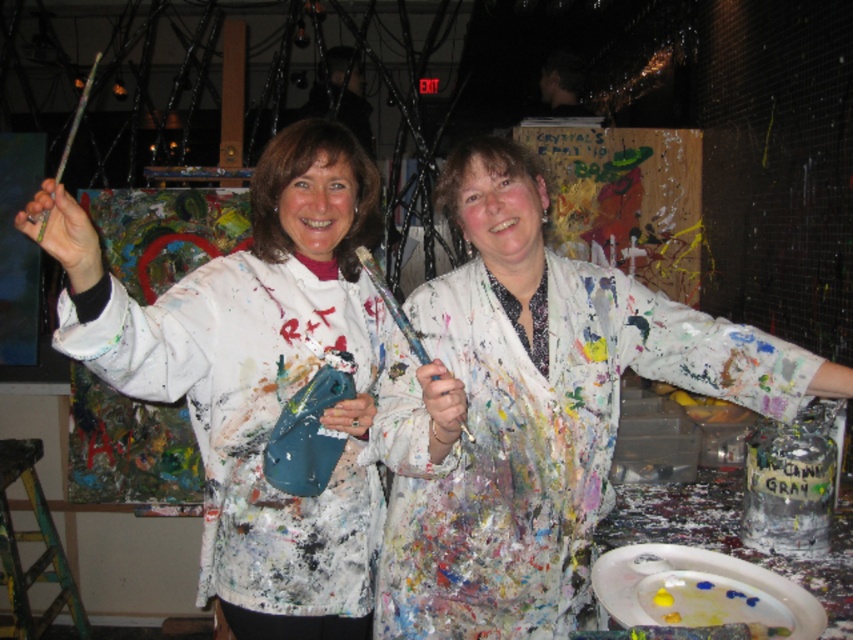
You are an art student trying to position two markers on a canvas. The first marker should be placed at point (x=775, y=390) and the second at point (x=358, y=173). Considering the positions of these points, which marker will be closer to the viewer?

The marker placed at point (x=775, y=390) will be closer to the viewer because it is in front of point (x=358, y=173).

You are an art teacher observing two students in an art studio. You notice a point at coordinates [531,408]. Based on the scene description, where is this point located?

The point at coordinates [531,408] is located on the paint splattered white shirt at center.